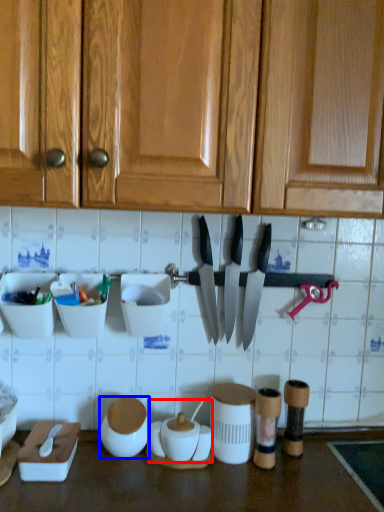
Question: Which of the following is the farthest to the observer, pottery (highlighted by a red box) or tableware (highlighted by a blue box)?

Choices:
 (A) pottery
 (B) tableware

Answer: (B)